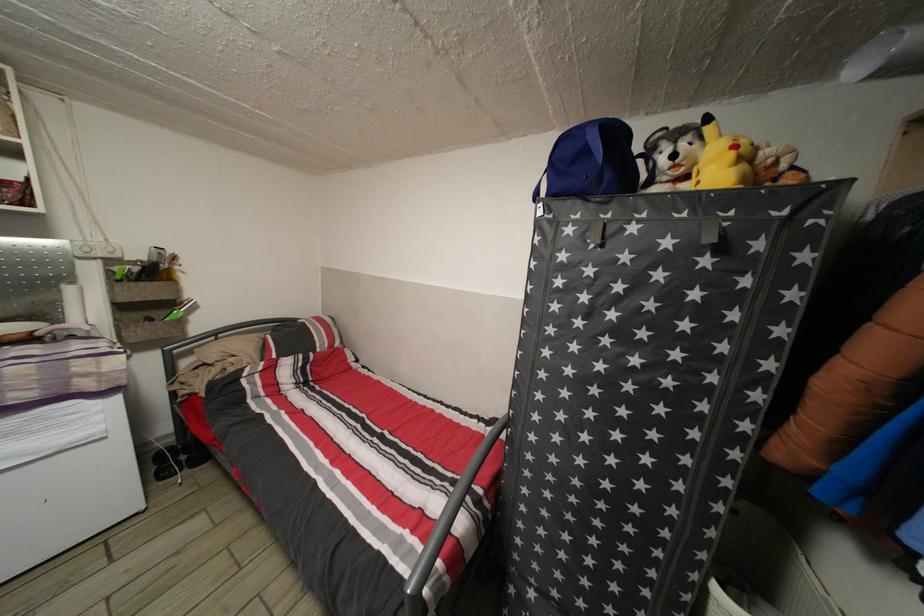
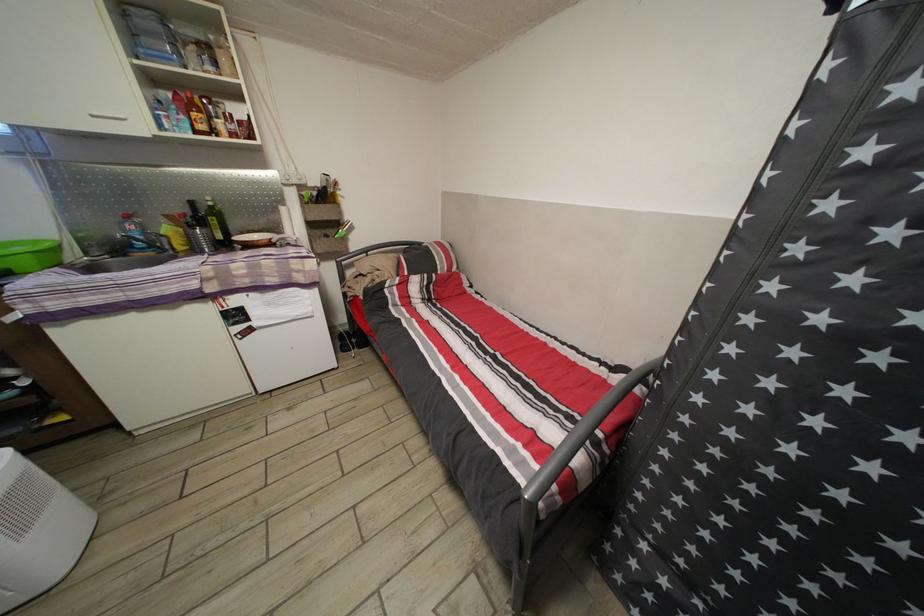
Question: Based on the continuous images, in which direction is the camera rotating? Reply with the corresponding letter.

Choices:
 (A) Left
 (B) Right
 (C) Up
 (D) Down

Answer: (A)